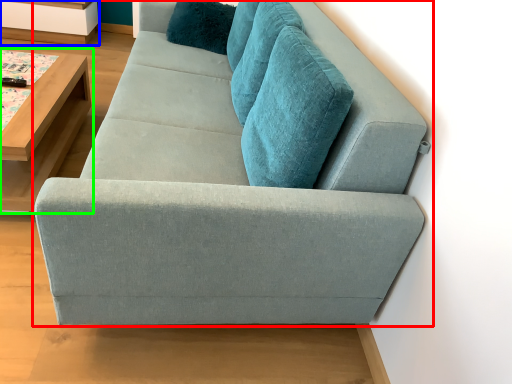
Question: Which object is positioned farthest from studio couch (highlighted by a red box)? Select from shelf (highlighted by a blue box) and table (highlighted by a green box).

Choices:
 (A) shelf
 (B) table

Answer: (A)